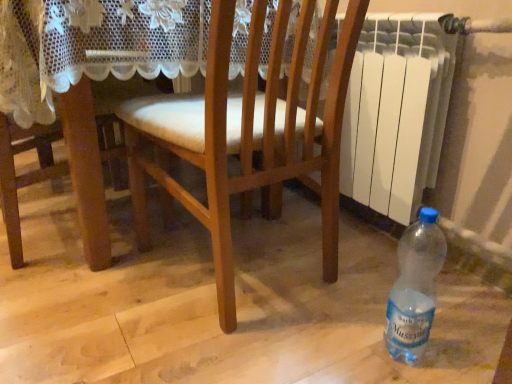
The image size is (512, 384). Find the location of `blank space to the left of translucent plastic bottle at lower right`. blank space to the left of translucent plastic bottle at lower right is located at coordinates (326, 342).